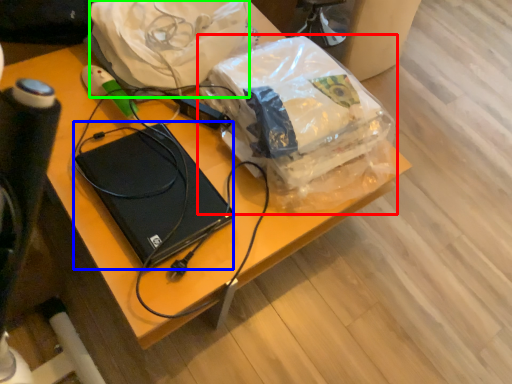
Question: Which object is the farthest from plastic bag (highlighted by a red box)? Choose among these: computer (highlighted by a blue box) or material (highlighted by a green box).

Choices:
 (A) computer
 (B) material

Answer: (A)